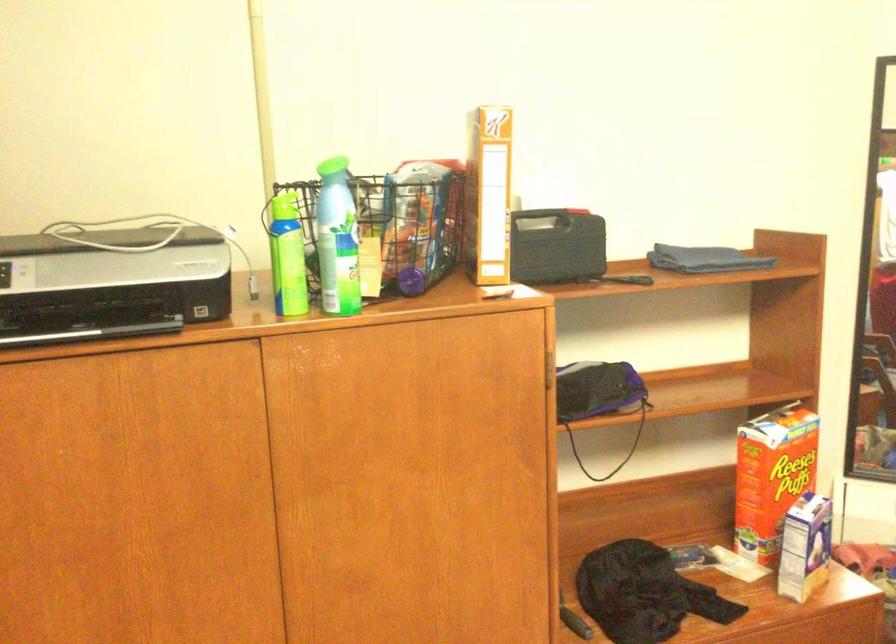
At what (x,y) coordinates should I click in order to perform the action: click on green spray can nozzle. Please return your answer as a coordinate pair (x, y). The image size is (896, 644). Looking at the image, I should click on (285, 205).